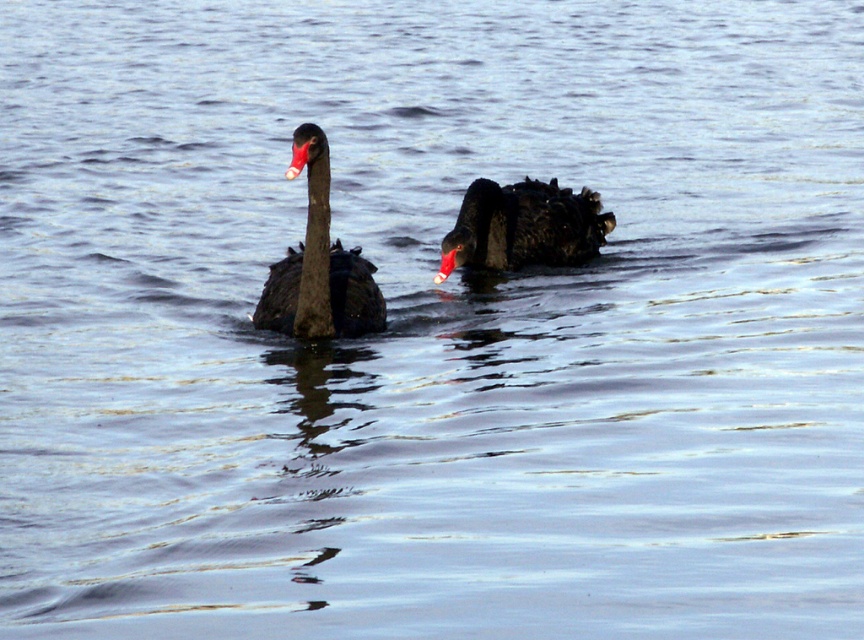
Who is more forward, (299, 172) or (494, 253)?

Point (299, 172) is more forward.

Does matte black swan at left appear on the left side of shiny black swan at center?

Correct, you'll find matte black swan at left to the left of shiny black swan at center.

Which is behind, point (313, 227) or point (583, 236)?

Point (583, 236)

You are a GUI agent. You are given a task and a screenshot of the screen. Output one action in this format:
    pyautogui.click(x=<x>, y=<y>)
    Task: Click on the matte black swan at left
    This screenshot has height=640, width=864.
    Given the screenshot: What is the action you would take?
    pyautogui.click(x=318, y=266)